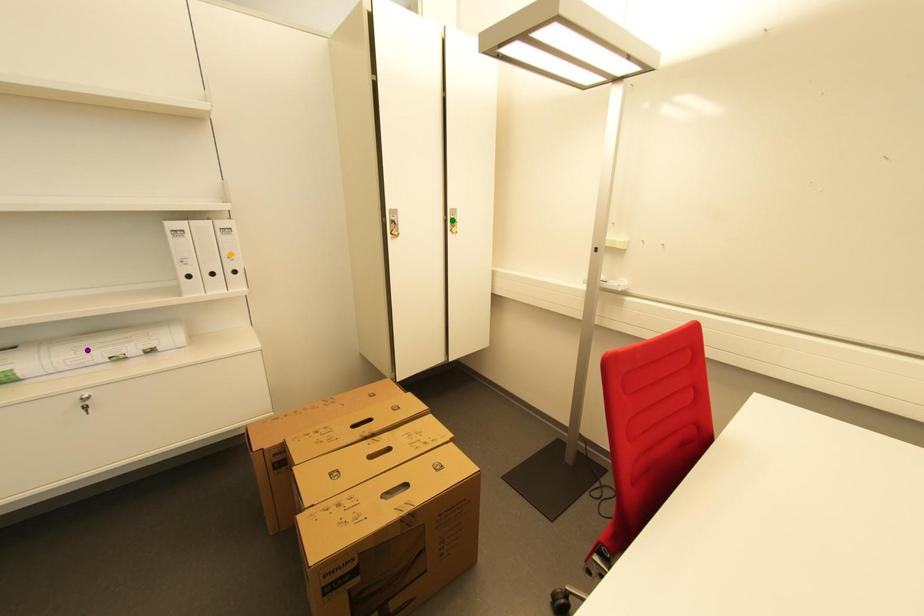
Order these from nearest to farthest:
orange point, green point, purple point

purple point, orange point, green point